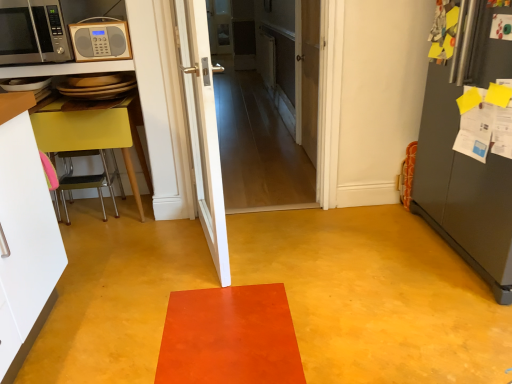
Find the location of a particular element. The image size is (512, 384). free region under white wooden door at center, which is counted as the 2th door, starting from the back (from a real-world perspective) is located at coordinates (248, 206).